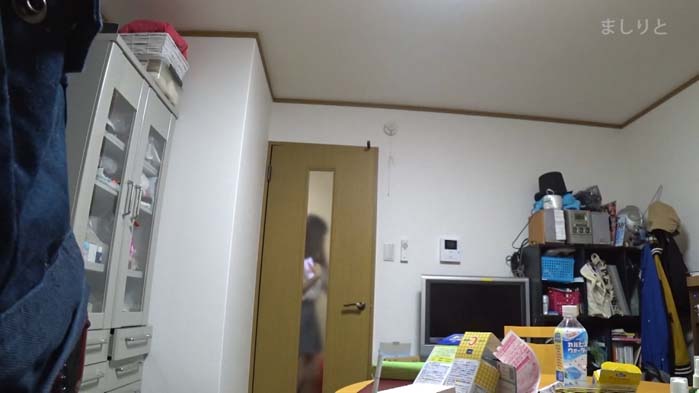
Where is `tv`? The width and height of the screenshot is (699, 393). tv is located at coordinates (466, 307).